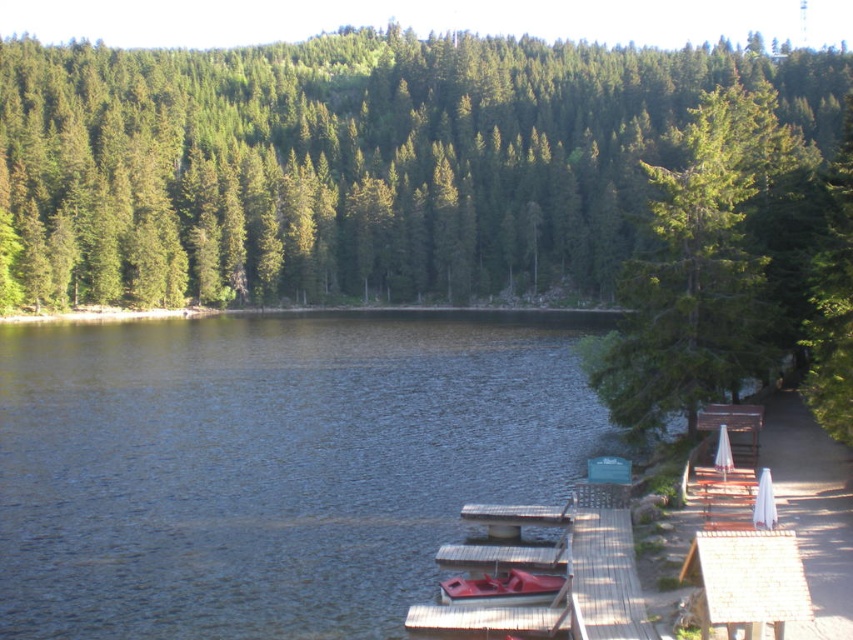
You are standing at the edge of the lake and see the point labeled as point (354, 163). What object is located at that point?

The point (354, 163) indicates a green matte tree at center.

You are standing at the lakeside and see two points marked in the scene. Which point, point [234,269] or point [544,586], is closer to you?

Point [234,269] is closer to you because it is further to the camera than point [544,586].

You are standing at the edge of the lake and want to locate the green matte tree at center. According to the coordinates provided, in which direction should you look relative to your position?

The green matte tree at center is located at coordinates point [354,163]. Based on standard coordinate systems, this places it slightly to the left and above your current position at the lake edge.